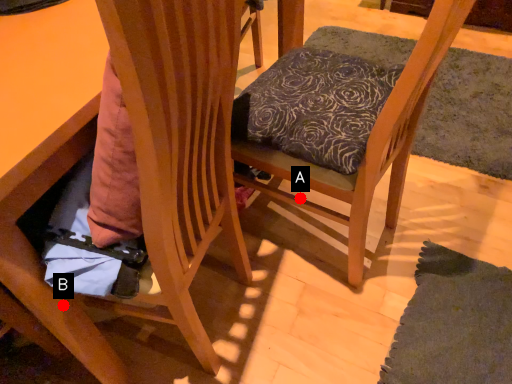
Question: Two points are circled on the image, labeled by A and B beside each circle. Which point appears farthest from the camera in this image?

Choices:
 (A) A is further
 (B) B is further

Answer: (A)